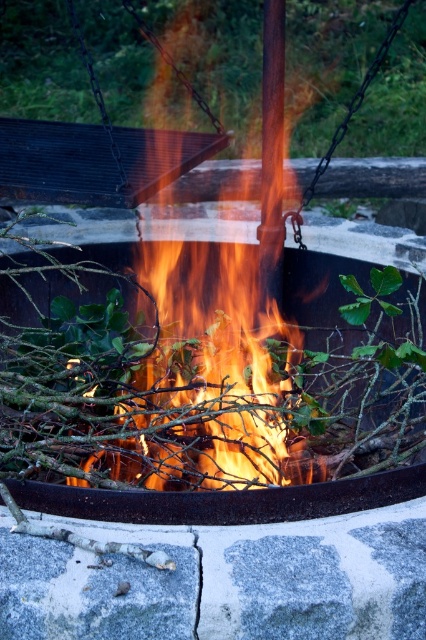
Question: Is flamewoodenfire at center further to the viewer compared to flaming wood at center?

Choices:
 (A) yes
 (B) no

Answer: (B)

Question: Which point is closer to the camera?

Choices:
 (A) (203, 486)
 (B) (250, 490)

Answer: (B)

Question: Is flamewoodenfire at center smaller than flaming wood at center?

Choices:
 (A) yes
 (B) no

Answer: (B)

Question: Which object appears farthest from the camera in this image?

Choices:
 (A) flaming wood at center
 (B) flamewoodenfire at center

Answer: (A)

Question: Which of the following is the closest to the observer?

Choices:
 (A) (186, 516)
 (B) (271, 93)

Answer: (A)

Question: Can you confirm if flamewoodenfire at center is thinner than flaming wood at center?

Choices:
 (A) yes
 (B) no

Answer: (B)